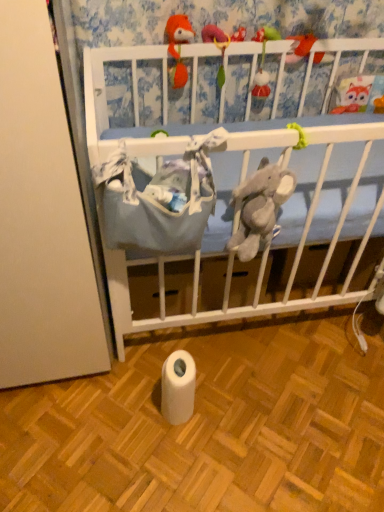
This screenshot has height=512, width=384. I want to click on unoccupied region to the right of white matte toilet paper at lower center, so click(x=236, y=413).